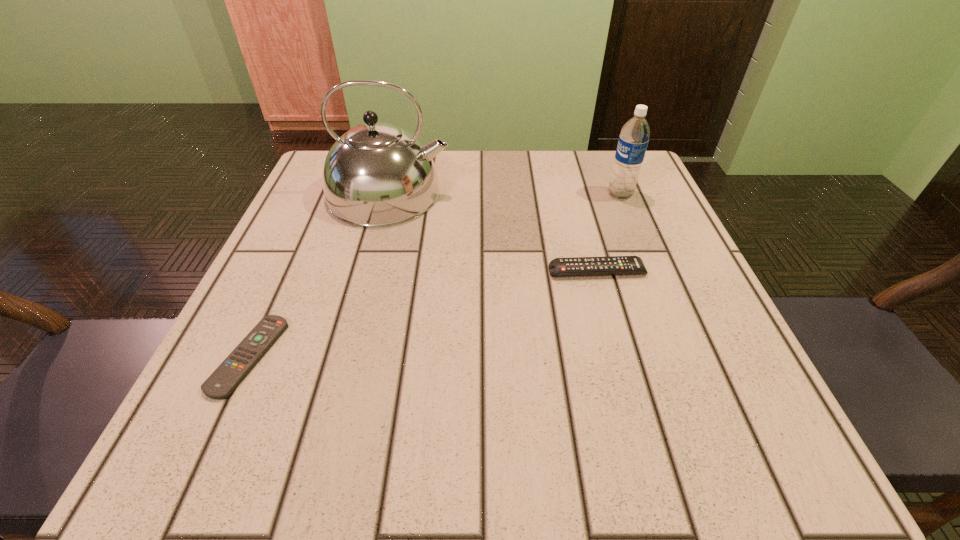
Where is `free spot between the farther remote control and the third shortest object`? free spot between the farther remote control and the third shortest object is located at coordinates (609, 233).

Where is `vacant area that lies between the nearest object and the water bottle`? The height and width of the screenshot is (540, 960). vacant area that lies between the nearest object and the water bottle is located at coordinates (435, 275).

I want to click on free spot between the shorter remote control and the water bottle, so click(435, 275).

Where is `free area in between the water bottle and the nearer remote control`? The height and width of the screenshot is (540, 960). free area in between the water bottle and the nearer remote control is located at coordinates (435, 275).

This screenshot has width=960, height=540. I want to click on object that is the closest to the kettle, so click(611, 265).

Locate which object ranks in proximity to the nearer remote control. Please provide its 2D coordinates. Your answer should be formatted as a tuple, i.e. [(x, y)], where the tuple contains the x and y coordinates of a point satisfying the conditions above.

[(377, 174)]

The image size is (960, 540). What are the coordinates of `vacant region that satisfies the following two spatial constraints: 1. from the spout of the second tallest object; 2. on the left side of the tallest object` in the screenshot? It's located at (389, 194).

Find the location of a particular element. vacant region that satisfies the following two spatial constraints: 1. from the spout of the tallest object; 2. on the left side of the water bottle is located at coordinates (389, 194).

Identify the location of vacant position in the image that satisfies the following two spatial constraints: 1. from the spout of the kettle; 2. on the right side of the second tallest object. This screenshot has height=540, width=960. [389, 194].

Identify the location of free space that satisfies the following two spatial constraints: 1. from the spout of the kettle; 2. on the back side of the third shortest object. (389, 194).